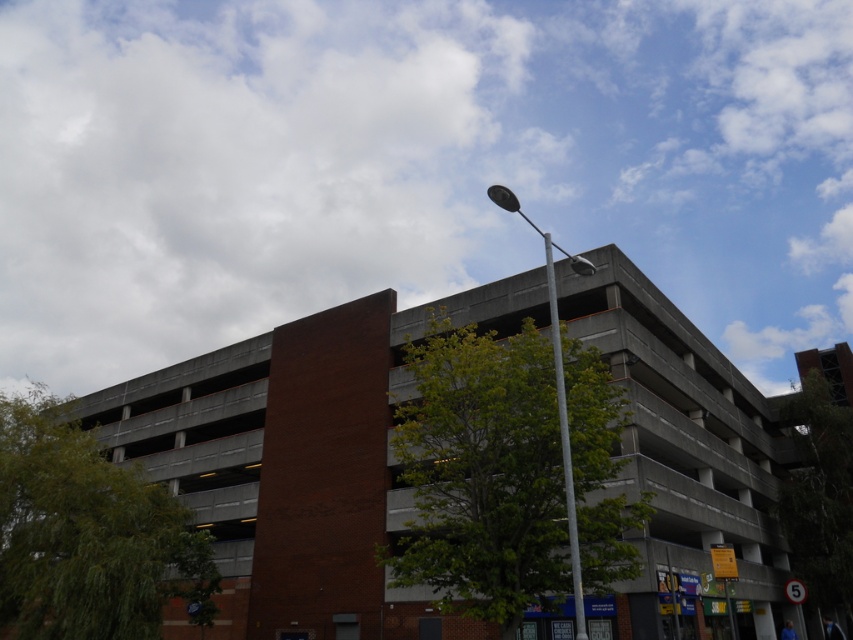
Question: Which point appears closest to the camera in this image?

Choices:
 (A) (788, 352)
 (B) (558, 387)
 (C) (566, 452)

Answer: (C)

Question: Does white fluffy cloud at upper center lie behind metallic pole at upper center?

Choices:
 (A) yes
 (B) no

Answer: (A)

Question: Which of these objects is positioned farthest from the metallic pole at upper center?

Choices:
 (A) silver metallic pole at upper center
 (B) white fluffy cloud at upper center

Answer: (B)

Question: Is white fluffy cloud at upper center smaller than silver metallic pole at upper center?

Choices:
 (A) no
 (B) yes

Answer: (A)

Question: Is metallic pole at upper center closer to the viewer compared to silver metallic pole at upper center?

Choices:
 (A) yes
 (B) no

Answer: (B)

Question: Which of these objects is positioned farthest from the silver metallic pole at upper center?

Choices:
 (A) white fluffy cloud at upper center
 (B) metallic pole at upper center

Answer: (A)